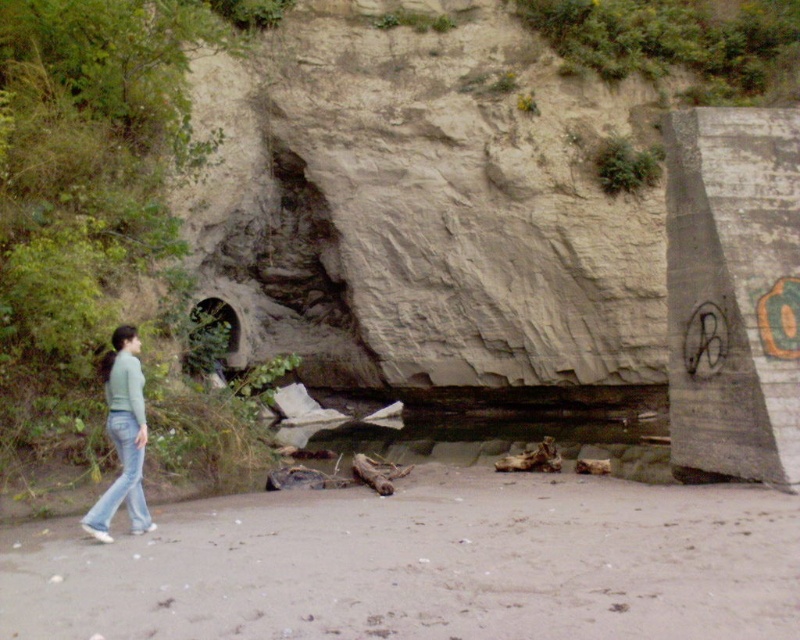
What is the exact coordinate of the brown sand at lower center in the image?

The brown sand at lower center is located at point (x=424, y=564).

You are standing at the point labeled point (x=741, y=552) and want to move to the point labeled point (x=112, y=515). Given that you can only move forward in a straight line, will you be able to reach the second point without changing direction?

Since point (x=741, y=552) is closer to the camera than point (x=112, y=515), moving forward in a straight line would take you away from the second point. Therefore, you cannot reach point (x=112, y=515) without changing direction.